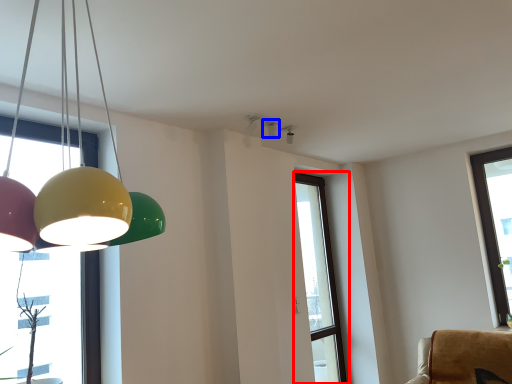
Question: Which object appears closest to the camera in this image, window (highlighted by a red box) or lamp (highlighted by a blue box)?

Choices:
 (A) window
 (B) lamp

Answer: (B)